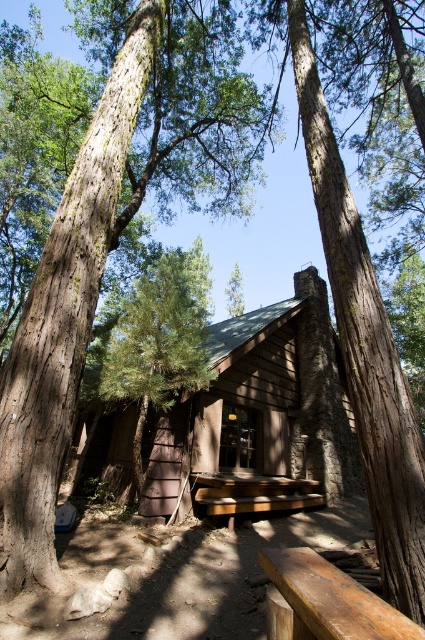
You are standing in a forest and see the point marked at coordinates (x=263, y=404). What object is located at that point?

The point at coordinates (x=263, y=404) indicates the brown wooden cabin at center.

You are standing in the forest and see the brown textured wood cabin at center. Based on its position coordinates, is the cabin closer to the top or bottom of the image?

The position of brown textured wood cabin at center is at point (112, 232). Since the y coordinate is 0.264, which is closer to the bottom of the image, the cabin is positioned closer to the bottom.